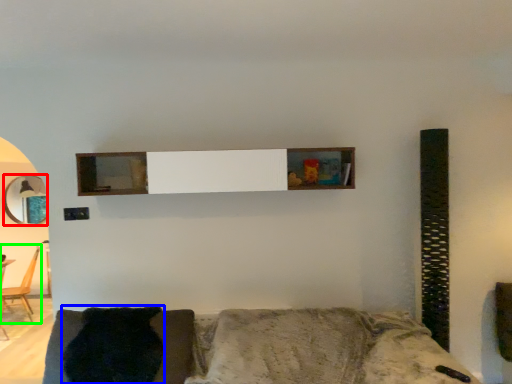
Question: Which is farther away from mirror (highlighted by a red box)? pillow (highlighted by a blue box) or chair (highlighted by a green box)?

Choices:
 (A) pillow
 (B) chair

Answer: (A)